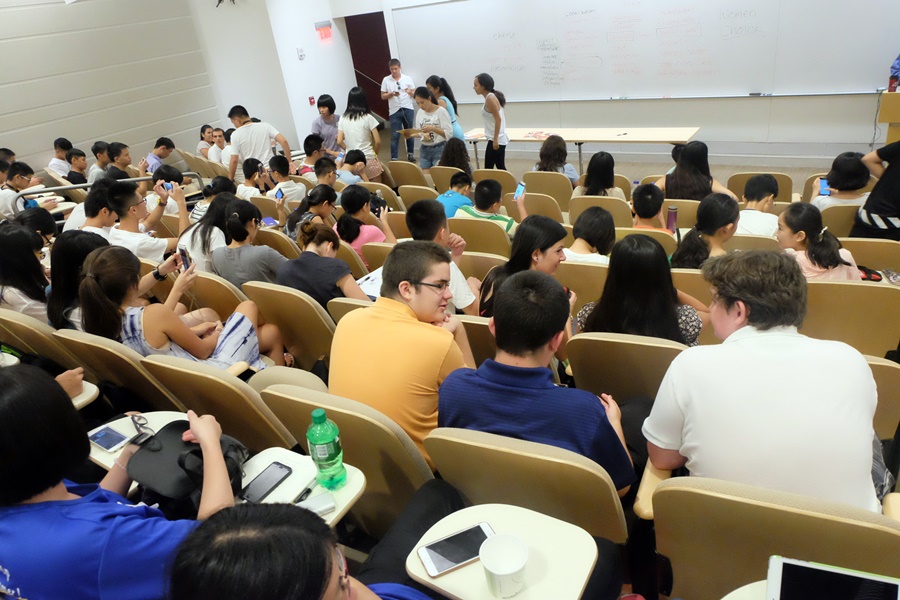
What are the coordinates of `seat` in the screenshot? It's located at (284, 379).